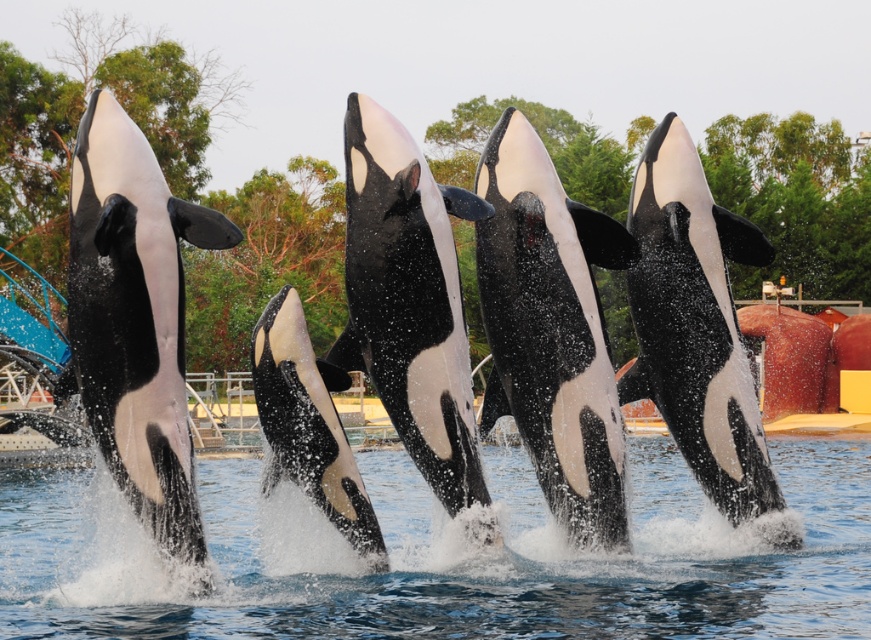
Question: Based on their relative distances, which object is farther from the black and white orca at left?

Choices:
 (A) black/white dolphin at center
 (B) black/white textured dolphin at center

Answer: (B)

Question: Can you confirm if black/white textured dolphin at center is thinner than black and white dolphin at center?

Choices:
 (A) yes
 (B) no

Answer: (A)

Question: Is black and white orca at left wider than black/white dolphin at center?

Choices:
 (A) yes
 (B) no

Answer: (A)

Question: Which point appears farthest from the camera in this image?

Choices:
 (A) (534, 429)
 (B) (207, 465)

Answer: (B)

Question: Can you confirm if black/white dolphin at center is thinner than black and white dolphin at center?

Choices:
 (A) no
 (B) yes

Answer: (B)

Question: Which point is farther to the camera?

Choices:
 (A) black and white orca at left
 (B) black and white dolphin at center

Answer: (B)